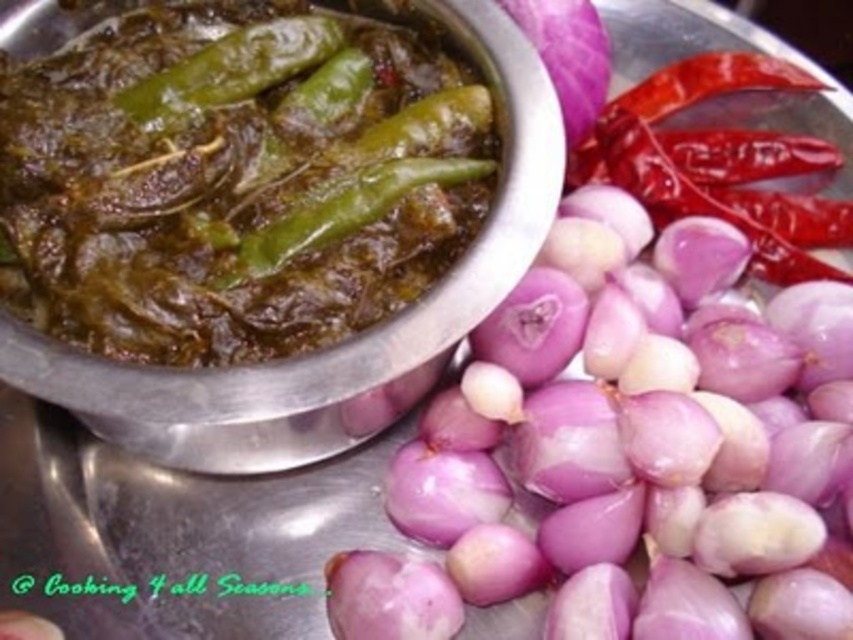
Can you confirm if green matte chili pepper at center is bigger than red matte chili pepper at upper right?

Yes, green matte chili pepper at center is bigger than red matte chili pepper at upper right.

Who is taller, green matte chili pepper at center or red matte chili pepper at upper right?

green matte chili pepper at center is taller.

Does point (86, 58) lie in front of point (726, 173)?

Yes, it is.

Identify the location of green matte chili pepper at center. (230, 186).